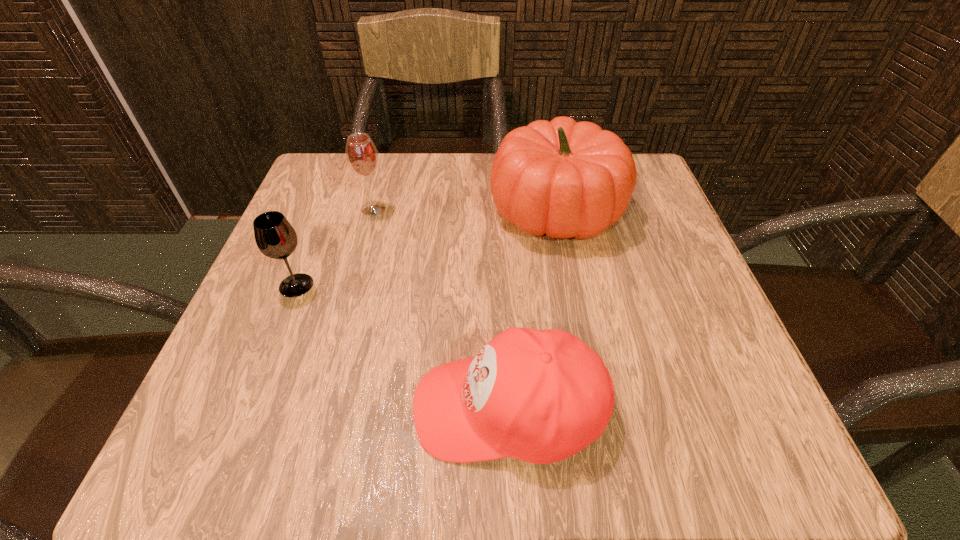
The image size is (960, 540). What are the coordinates of `vacant space located 0.190m on the front panel of the baseball cap` in the screenshot? It's located at (275, 408).

Where is `vacant space located on the front panel of the baseball cap`? vacant space located on the front panel of the baseball cap is located at coordinates (267, 408).

Find the location of a particular element. Image resolution: width=960 pixels, height=540 pixels. pumpkin that is at the far edge is located at coordinates (567, 179).

Image resolution: width=960 pixels, height=540 pixels. What are the coordinates of `wineglass that is positioned at the far edge` in the screenshot? It's located at (361, 154).

The image size is (960, 540). I want to click on object located at the near edge, so click(x=540, y=396).

Identify the location of object that is at the right edge. (567, 179).

The height and width of the screenshot is (540, 960). Find the location of `object located in the far left corner section of the desktop`. object located in the far left corner section of the desktop is located at coordinates (361, 154).

Locate an element on the screen. The width and height of the screenshot is (960, 540). object that is at the far right corner is located at coordinates (567, 179).

You are a GUI agent. You are given a task and a screenshot of the screen. Output one action in this format:
    pyautogui.click(x=<x>, y=<y>)
    Task: Click on the vacant region at the far edge of the desktop
    This screenshot has height=540, width=960.
    Given the screenshot: What is the action you would take?
    pyautogui.click(x=440, y=193)

In the image, there is a desktop. Where is `vacant space at the near edge`? This screenshot has width=960, height=540. vacant space at the near edge is located at coordinates pyautogui.click(x=648, y=452).